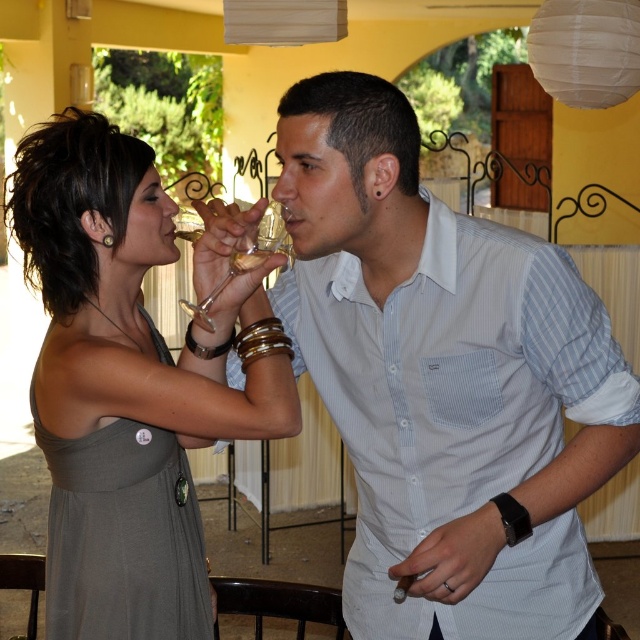
Question: Which object is positioned closest to the clear glass wine at upper center?

Choices:
 (A) transparent glass wine glass at center
 (B) white striped shirt at center
 (C) translucent glass at upper center
 (D) matte gray dress at center

Answer: (C)

Question: Is transparent glass wine glass at center thinner than translucent glass at upper center?

Choices:
 (A) no
 (B) yes

Answer: (A)

Question: Is white striped shirt at center smaller than clear glass wine at upper center?

Choices:
 (A) no
 (B) yes

Answer: (A)

Question: Can you confirm if white striped shirt at center is positioned to the left of translucent glass at upper center?

Choices:
 (A) no
 (B) yes

Answer: (A)

Question: Which of the following is the closest to the observer?

Choices:
 (A) click(x=202, y=305)
 (B) click(x=182, y=234)

Answer: (A)

Question: Among these points, which one is farthest from the camera?

Choices:
 (A) (196, 237)
 (B) (365, 348)
 (C) (54, 365)

Answer: (B)